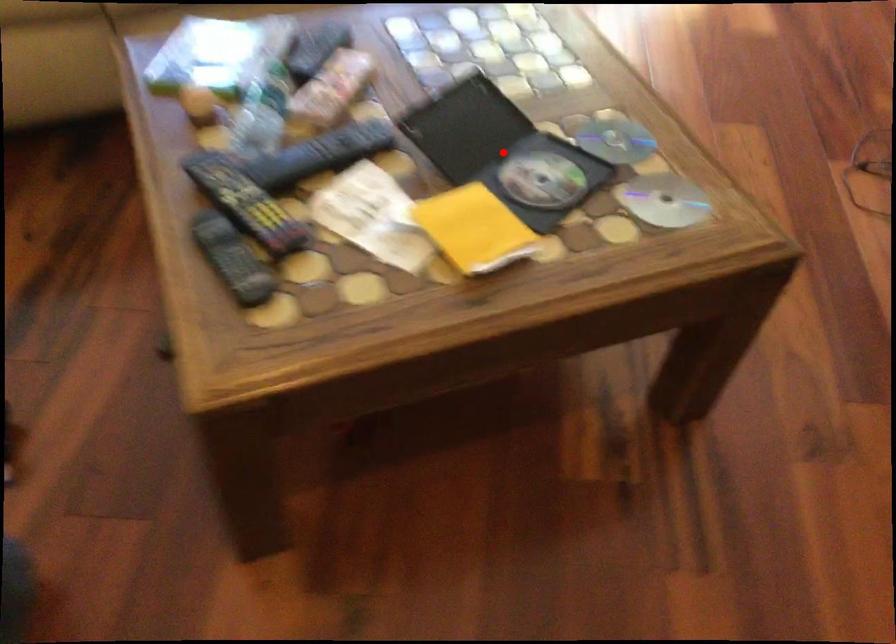
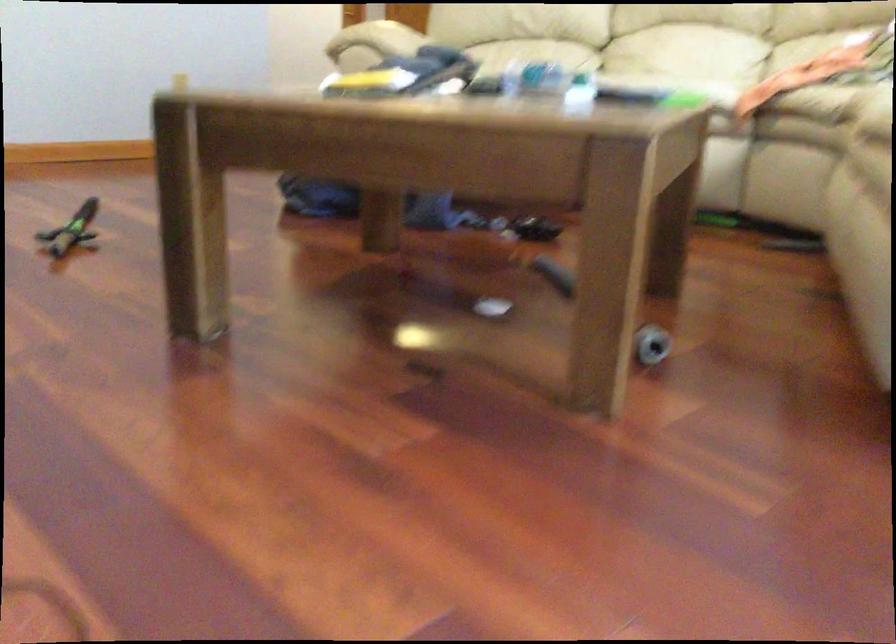
Question: I am providing you with two images of the same scene from different viewpoints. A red point is marked on the first image. Can you still see the location of the red point in image 2?

Choices:
 (A) Yes
 (B) No

Answer: (B)